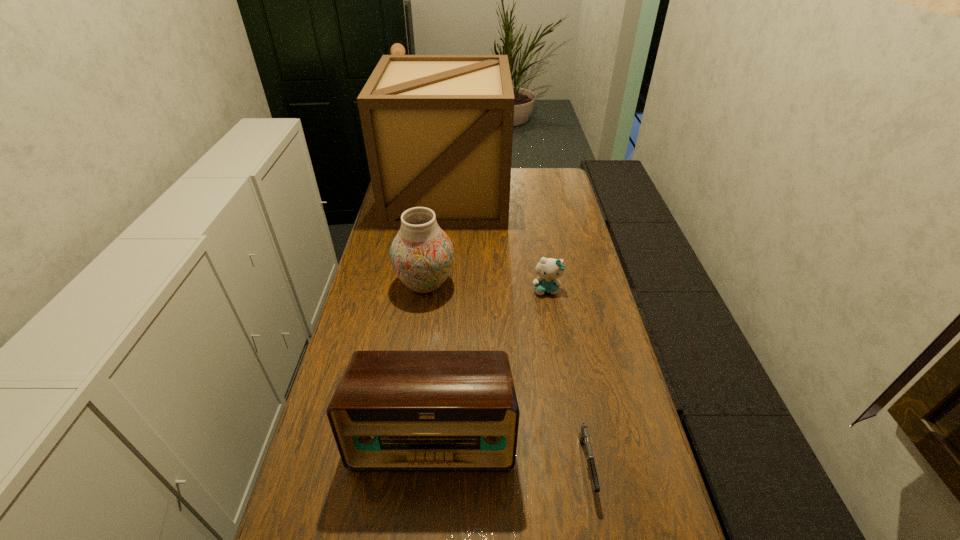
Locate an element on the screen. The width and height of the screenshot is (960, 540). free space at the far right corner of the desktop is located at coordinates click(534, 180).

What are the coordinates of `free area in between the fourth tallest object and the box` in the screenshot? It's located at (497, 242).

Find the location of a particular element. free spot between the gun and the second shortest object is located at coordinates (566, 377).

This screenshot has width=960, height=540. I want to click on object that is the third closest one to the vase, so click(392, 410).

The image size is (960, 540). I want to click on object that is the second closest to the shortest object, so click(548, 269).